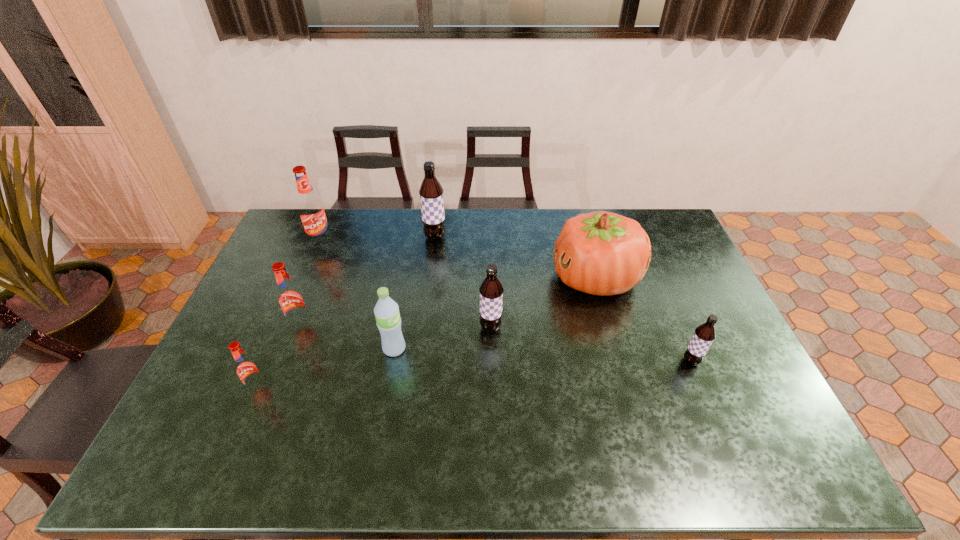
Where is `free space at the near left corner of the desktop`? This screenshot has width=960, height=540. free space at the near left corner of the desktop is located at coordinates (180, 453).

You are a GUI agent. You are given a task and a screenshot of the screen. Output one action in this format:
    pyautogui.click(x=<x>, y=<y>)
    Task: Click on the free spot between the farthest red root beer and the green water bottle
    The width and height of the screenshot is (960, 540).
    Given the screenshot: What is the action you would take?
    pyautogui.click(x=358, y=295)

You are a GUI agent. You are given a task and a screenshot of the screen. Output one action in this format:
    pyautogui.click(x=<x>, y=<y>)
    Task: Click on the free point between the green water bottle and the second nearest red root beer
    The image size is (960, 540).
    Given the screenshot: What is the action you would take?
    pyautogui.click(x=348, y=337)

Find the location of a particular element. This screenshot has height=540, width=960. free spot between the fifth object from left to right and the second nearest brown root beer is located at coordinates (463, 282).

At what (x,y) coordinates should I click in order to perform the action: click on free space that is in between the rightmost brown root beer and the smallest red root beer. Please return your answer as a coordinate pair (x, y). This screenshot has height=540, width=960. Looking at the image, I should click on (475, 375).

The height and width of the screenshot is (540, 960). I want to click on vacant space that is in between the fourth root beer from left to right and the second nearest red root beer, so click(369, 281).

In order to click on free space between the water bottle and the second smallest red root beer in this screenshot , I will do pos(348,337).

Image resolution: width=960 pixels, height=540 pixels. Find the location of `free space between the nearest brown root beer and the fourth object from left to right`. free space between the nearest brown root beer and the fourth object from left to right is located at coordinates (542, 355).

The width and height of the screenshot is (960, 540). In order to click on unoccupied area between the second biggest red root beer and the biggest red root beer in this screenshot , I will do `click(311, 284)`.

Find the location of a particular element. This screenshot has width=960, height=540. free space between the farthest red root beer and the pumpkin is located at coordinates (458, 260).